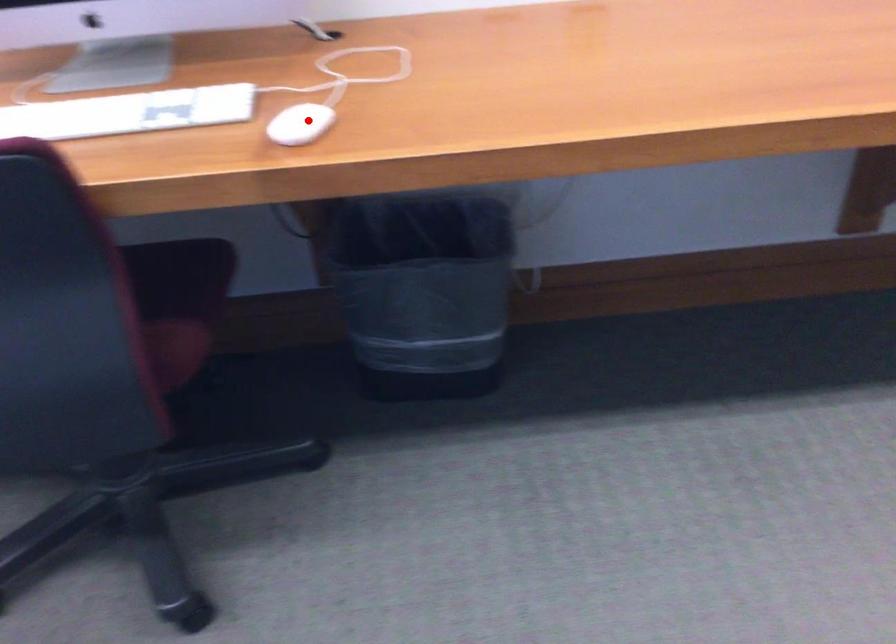
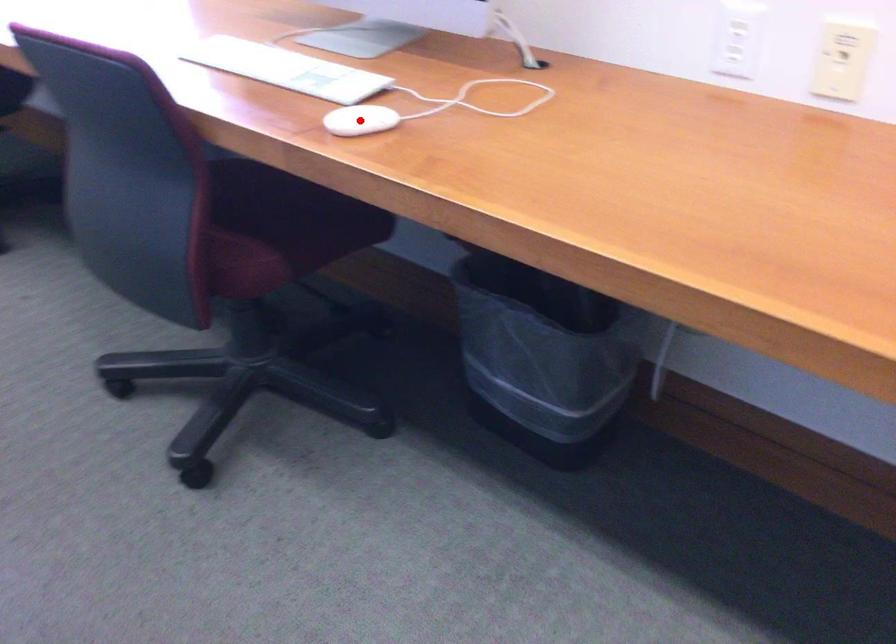
I am providing you with two images of the same scene from different viewpoints. A red point is marked on the first image and another point is marked on the second image. Are the points marked in image1 and image2 representing the same 3D position?

Yes